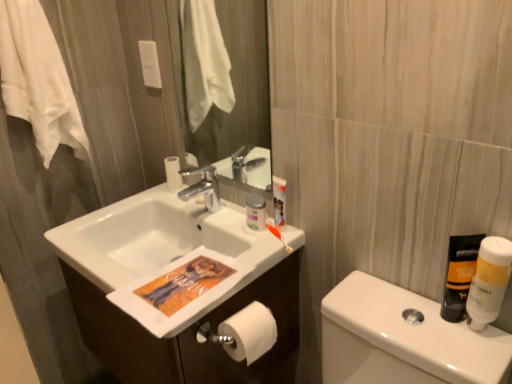
This screenshot has height=384, width=512. Describe the element at coordinates (248, 333) in the screenshot. I see `white matte toilet paper at lower center` at that location.

What is the approximate width of white glossy toilet paper at lower left?

white glossy toilet paper at lower left is 19.61 inches wide.

Identify the location of white matte toilet paper at lower center. (248, 333).

Is matte plastic container at upper center positioned with its back to white matte toilet paper at lower center?

matte plastic container at upper center does not have its back to white matte toilet paper at lower center.

Find the location of a particular element. toilet paper below the matte plastic container at upper center (from a real-world perspective) is located at coordinates (248, 333).

Is point (255, 198) closer or farther from the camera than point (244, 332)?

Point (255, 198) is farther from the camera than point (244, 332).

In the image, is matte plastic container at upper center positioned in front of or behind white matte toilet paper at lower center?

Clearly, matte plastic container at upper center is behind white matte toilet paper at lower center.

Is white glossy sink at center surrounded by white matte bottle at right, arranged as the 2th mouthwash when viewed from the left?

That's incorrect, white glossy sink at center is not inside white matte bottle at right, arranged as the 2th mouthwash when viewed from the left.

Looking at their sizes, would you say white matte bottle at right, arranged as the 2th mouthwash when viewed from the left, is wider or thinner than white glossy sink at center?

white matte bottle at right, arranged as the 2th mouthwash when viewed from the left, is thinner than white glossy sink at center.

From a real-world perspective, relative to white glossy sink at center, is white matte bottle at right, which is counted as the first mouthwash, starting from the right, vertically above or below?

white matte bottle at right, which is counted as the first mouthwash, starting from the right, is above white glossy sink at center.

Which is behind, point (494, 261) or point (138, 302)?

The point (138, 302) is farther.

Can you confirm if white glossy sink at center is positioned to the right of translucent plastic bottle at right, which appears as the 2th mouthwash when viewed from the right?

In fact, white glossy sink at center is to the left of translucent plastic bottle at right, which appears as the 2th mouthwash when viewed from the right.

This screenshot has width=512, height=384. Find the location of `sink that is behind the translucent plastic bottle at right, which appears as the 2th mouthwash when viewed from the right`. sink that is behind the translucent plastic bottle at right, which appears as the 2th mouthwash when viewed from the right is located at coordinates (161, 251).

Is white glossy sink at center spatially inside translucent plastic bottle at right, which appears as the 2th mouthwash when viewed from the right, or outside of it?

white glossy sink at center exists outside the volume of translucent plastic bottle at right, which appears as the 2th mouthwash when viewed from the right.

Consider the image. How different are the orientations of white glossy sink at center and translucent plastic bottle at right, the first mouthwash when ordered from left to right, in degrees?

38.3 degrees separate the facing orientations of white glossy sink at center and translucent plastic bottle at right, the first mouthwash when ordered from left to right.

Which of these two, white glossy sink at center or white matte bottle at right, arranged as the 2th mouthwash when viewed from the left, stands taller?

white matte bottle at right, arranged as the 2th mouthwash when viewed from the left, is taller.

From the picture: What's the angular difference between white glossy sink at center and white matte bottle at right, arranged as the 2th mouthwash when viewed from the left,'s facing directions?

2.37 degrees.

Is white glossy sink at center bigger or smaller than white matte bottle at right, arranged as the 2th mouthwash when viewed from the left?

white glossy sink at center is bigger than white matte bottle at right, arranged as the 2th mouthwash when viewed from the left.

Can you see white glossy sink at center touching white matte bottle at right, which is counted as the first mouthwash, starting from the right?

white glossy sink at center and white matte bottle at right, which is counted as the first mouthwash, starting from the right, are not in contact.

Is translucent plastic bottle at right, the first mouthwash when ordered from left to right, completely or partially inside white cotton towel at upper left?

No, translucent plastic bottle at right, the first mouthwash when ordered from left to right, is located outside of white cotton towel at upper left.

Based on the photo, which object is more forward, white cotton towel at upper left or translucent plastic bottle at right, the first mouthwash when ordered from left to right?

Positioned in front is translucent plastic bottle at right, the first mouthwash when ordered from left to right.

How distant is white cotton towel at upper left from translucent plastic bottle at right, the first mouthwash when ordered from left to right?

The distance of white cotton towel at upper left from translucent plastic bottle at right, the first mouthwash when ordered from left to right, is 1.20 meters.

Is white cotton towel at upper left facing towards translucent plastic bottle at right, which appears as the 2th mouthwash when viewed from the right?

Yes, white cotton towel at upper left is oriented towards translucent plastic bottle at right, which appears as the 2th mouthwash when viewed from the right.

From the image's perspective, which one is positioned lower, white matte toilet paper at lower center or translucent plastic bottle at right, the first mouthwash when ordered from left to right?

white matte toilet paper at lower center is shown below in the image.

Consider the image. Is white matte toilet paper at lower center in front of or behind translucent plastic bottle at right, the first mouthwash when ordered from left to right, in the image?

white matte toilet paper at lower center is behind translucent plastic bottle at right, the first mouthwash when ordered from left to right.

Consider the image. Looking at the image, does white matte toilet paper at lower center seem bigger or smaller compared to translucent plastic bottle at right, the first mouthwash when ordered from left to right?

In the image, white matte toilet paper at lower center appears to be larger than translucent plastic bottle at right, the first mouthwash when ordered from left to right.

Considering the points (444, 356) and (251, 213), which point is behind, point (444, 356) or point (251, 213)?

The point (251, 213) is farther.

From the image's perspective, is white glossy toilet paper at lower left under matte plastic container at upper center?

Yes.

From a real-world perspective, is white glossy toilet paper at lower left located higher than matte plastic container at upper center?

Actually, white glossy toilet paper at lower left is physically below matte plastic container at upper center in the real world.

Could you measure the distance between white glossy toilet paper at lower left and matte plastic container at upper center?

A distance of 17.50 inches exists between white glossy toilet paper at lower left and matte plastic container at upper center.

I want to click on toilet paper lying below the matte plastic container at upper center (from the image's perspective), so click(248, 333).

Where is `the 2nd mouthwash counting from the right side of the white glossy sink at center`? the 2nd mouthwash counting from the right side of the white glossy sink at center is located at coordinates pyautogui.click(x=489, y=281).

Based on their spatial positions, is matte glass mirror at upper center or translucent plastic bottle at right, which appears as the 2th mouthwash when viewed from the right, further from matte plastic container at upper center?

matte glass mirror at upper center is positioned further to the anchor matte plastic container at upper center.

Which object lies nearer to the anchor point white cotton towel at upper left, white glossy toilet paper at lower left or translucent plastic bottle at right, the first mouthwash when ordered from left to right?

The object closer to white cotton towel at upper left is white glossy toilet paper at lower left.

Based on their spatial positions, is orange translucent toothbrush at upper right or white glossy sink at center further from translucent plastic bottle at right, which appears as the 2th mouthwash when viewed from the right?

The object further to translucent plastic bottle at right, which appears as the 2th mouthwash when viewed from the right, is white glossy sink at center.

From the image, which object appears to be nearer to white glossy toilet paper at lower left, matte plastic container at upper center or white glossy cabinet at center?

white glossy cabinet at center is closer to white glossy toilet paper at lower left.

Estimate the real-world distances between objects in this image. Which object is further from translucent plastic bottle at right, which appears as the 2th mouthwash when viewed from the right, white glossy cabinet at center or orange translucent toothbrush at upper right?

Based on the image, white glossy cabinet at center appears to be further to translucent plastic bottle at right, which appears as the 2th mouthwash when viewed from the right.

When comparing their distances from matte glass mirror at upper center, does white cotton towel at upper left or white glossy cabinet at center seem further?

white glossy cabinet at center is further to matte glass mirror at upper center.

From the image, which object appears to be farther from orange translucent toothbrush at upper right, matte glass mirror at upper center or white glossy toilet paper at lower left?

Based on the image, matte glass mirror at upper center appears to be further to orange translucent toothbrush at upper right.

When comparing their distances from orange translucent toothbrush at upper right, does white glossy toilet paper at lower left or matte glass mirror at upper center seem closer?

white glossy toilet paper at lower left is closer to orange translucent toothbrush at upper right.

Locate an element on the screen. The height and width of the screenshot is (384, 512). toilet paper situated between white glossy sink at center and translucent plastic bottle at right, the first mouthwash when ordered from left to right, from left to right is located at coordinates (248, 333).

You are a GUI agent. You are given a task and a screenshot of the screen. Output one action in this format:
    pyautogui.click(x=<x>, y=<y>)
    Task: Click on the bathroom cabinet between matte glass mirror at upper center and white glossy toilet paper at lower left from top to bottom
    
    Given the screenshot: What is the action you would take?
    pyautogui.click(x=190, y=335)

I want to click on toothbrush located between white matte toilet paper at lower center and white matte bottle at right, which is counted as the first mouthwash, starting from the right, in the left-right direction, so click(x=276, y=233).

This screenshot has width=512, height=384. I want to click on sink located between white glossy toilet paper at lower left and orange translucent toothbrush at upper right in the depth direction, so click(161, 251).